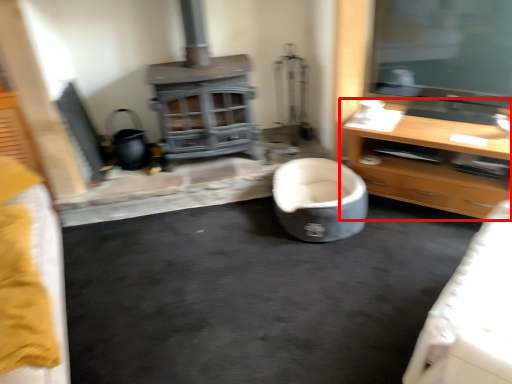
Question: From the image's perspective, where is cabinetry (annotated by the red box) located in relation to bean bag chair in the image?

Choices:
 (A) below
 (B) above

Answer: (B)